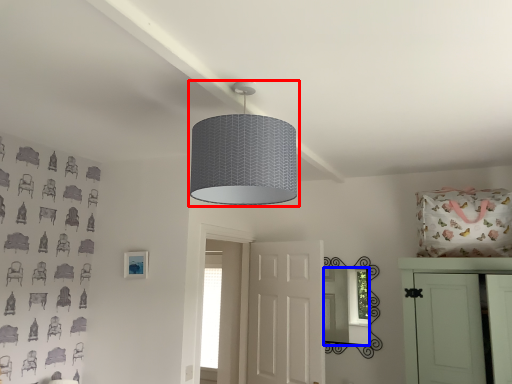
Question: Which object is further to the camera taking this photo, lamp (highlighted by a red box) or mirror (highlighted by a blue box)?

Choices:
 (A) lamp
 (B) mirror

Answer: (B)